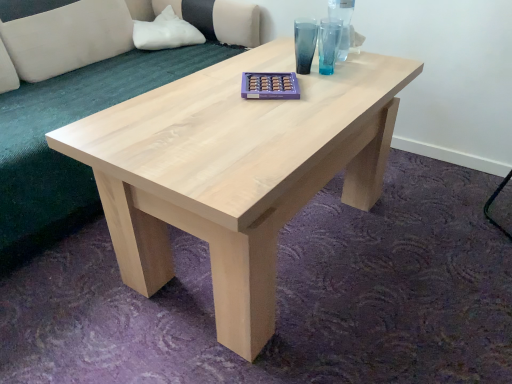
Identify the location of light beige fabric couch at upper left. This screenshot has width=512, height=384. (73, 121).

The image size is (512, 384). I want to click on transparent glass vase at upper center, so click(343, 23).

Is transparent glass vase at upper center next to white fabric pillow at upper left?

transparent glass vase at upper center is not next to white fabric pillow at upper left, and they're not touching.

What are the coordinates of `pillow behind the transparent glass vase at upper center` in the screenshot? It's located at (165, 32).

Is transparent glass vase at upper center aimed at white fabric pillow at upper left?

No, transparent glass vase at upper center is not oriented towards white fabric pillow at upper left.

Is white fabric pillow at upper left a part of transparent glass vase at upper center?

No, white fabric pillow at upper left is not surrounded by transparent glass vase at upper center.

Is natural wood coffee table at center wider than transparent glass vase at upper center?

Indeed, natural wood coffee table at center has a greater width compared to transparent glass vase at upper center.

Which is more to the right, natural wood coffee table at center or transparent glass vase at upper center?

From the viewer's perspective, transparent glass vase at upper center appears more on the right side.

Does natural wood coffee table at center have a larger size compared to transparent glass vase at upper center?

Indeed, natural wood coffee table at center has a larger size compared to transparent glass vase at upper center.

Is natural wood coffee table at center taller than transparent glass vase at upper center?

No, natural wood coffee table at center is not taller than transparent glass vase at upper center.

From a real-world perspective, which object rests below the other?

From a 3D spatial view, natural wood coffee table at center is below.

Is white fabric pillow at upper left positioned far away from natural wood coffee table at center?

Yes.

Consider the image. Is white fabric pillow at upper left in front of or behind natural wood coffee table at center in the image?

Clearly, white fabric pillow at upper left is behind natural wood coffee table at center.

At what (x,y) coordinates should I click in order to perform the action: click on glass vase that appears above the light beige fabric couch at upper left (from the image's perspective). Please return your answer as a coordinate pair (x, y). The image size is (512, 384). Looking at the image, I should click on (343, 23).

Considering their positions, is transparent glass vase at upper center located in front of or behind light beige fabric couch at upper left?

transparent glass vase at upper center is positioned farther from the viewer than light beige fabric couch at upper left.

In the scene shown: Which is closer, (345, 23) or (72, 221)?

Point (345, 23).

Could you measure the distance between transparent glass vase at upper center and light beige fabric couch at upper left?

They are 37.77 inches apart.

Considering the relative sizes of light beige fabric couch at upper left and natural wood coffee table at center in the image provided, is light beige fabric couch at upper left taller than natural wood coffee table at center?

Indeed, light beige fabric couch at upper left has a greater height compared to natural wood coffee table at center.

Which is in front, light beige fabric couch at upper left or natural wood coffee table at center?

natural wood coffee table at center.

Based on their positions, is light beige fabric couch at upper left located to the left or right of natural wood coffee table at center?

Based on their positions, light beige fabric couch at upper left is located to the left of natural wood coffee table at center.

From the image's perspective, who appears lower, light beige fabric couch at upper left or natural wood coffee table at center?

natural wood coffee table at center appears lower in the image.

From the image's perspective, which one is positioned lower, white fabric pillow at upper left or light beige fabric couch at upper left?

light beige fabric couch at upper left appears lower in the image.

From a real-world perspective, is white fabric pillow at upper left under light beige fabric couch at upper left?

Incorrect, from a real-world perspective, white fabric pillow at upper left is higher than light beige fabric couch at upper left.

Considering the relative positions of white fabric pillow at upper left and light beige fabric couch at upper left in the image provided, is white fabric pillow at upper left behind light beige fabric couch at upper left?

Yes, the depth of white fabric pillow at upper left is greater than that of light beige fabric couch at upper left.

Is white fabric pillow at upper left not inside light beige fabric couch at upper left?

Actually, white fabric pillow at upper left is within light beige fabric couch at upper left.

Which object is closer to the camera, transparent glass vase at upper center or natural wood coffee table at center?

natural wood coffee table at center is in front.

Considering the relative positions of transparent glass vase at upper center and natural wood coffee table at center in the image provided, is transparent glass vase at upper center to the left or to the right of natural wood coffee table at center?

Result: From the image, it's evident that transparent glass vase at upper center is to the right of natural wood coffee table at center.

Can you confirm if transparent glass vase at upper center is shorter than natural wood coffee table at center?

Incorrect, the height of transparent glass vase at upper center does not fall short of that of natural wood coffee table at center.

Is transparent glass vase at upper center not inside natural wood coffee table at center?

Yes, transparent glass vase at upper center is not within natural wood coffee table at center.

Where is `glass vase below the white fabric pillow at upper left (from the image's perspective)`? glass vase below the white fabric pillow at upper left (from the image's perspective) is located at coordinates (343, 23).

At what (x,y) coordinates should I click in order to perform the action: click on glass vase lying behind the natural wood coffee table at center. Please return your answer as a coordinate pair (x, y). Looking at the image, I should click on (343, 23).

From the image, which object appears to be nearer to transparent glass vase at upper center, natural wood coffee table at center or light beige fabric couch at upper left?

Based on the image, natural wood coffee table at center appears to be nearer to transparent glass vase at upper center.

Looking at the image, which one is located further to white fabric pillow at upper left, natural wood coffee table at center or transparent glass vase at upper center?

natural wood coffee table at center.

Which object lies further to the anchor point transparent glass vase at upper center, white fabric pillow at upper left or light beige fabric couch at upper left?

Based on the image, white fabric pillow at upper left appears to be further to transparent glass vase at upper center.

From the image, which object appears to be farther from natural wood coffee table at center, transparent glass vase at upper center or white fabric pillow at upper left?

white fabric pillow at upper left lies further to natural wood coffee table at center than the other object.

Based on their spatial positions, is transparent glass vase at upper center or light beige fabric couch at upper left closer to white fabric pillow at upper left?

light beige fabric couch at upper left.

From the image, which object appears to be nearer to natural wood coffee table at center, light beige fabric couch at upper left or transparent glass vase at upper center?

transparent glass vase at upper center is closer to natural wood coffee table at center.

Based on their spatial positions, is white fabric pillow at upper left or natural wood coffee table at center closer to light beige fabric couch at upper left?

Based on the image, white fabric pillow at upper left appears to be nearer to light beige fabric couch at upper left.

From the image, which object appears to be nearer to natural wood coffee table at center, white fabric pillow at upper left or transparent glass vase at upper center?

transparent glass vase at upper center lies closer to natural wood coffee table at center than the other object.

Identify the location of glass vase located between natural wood coffee table at center and white fabric pillow at upper left in the depth direction. Image resolution: width=512 pixels, height=384 pixels. (343, 23).

At what (x,y) coordinates should I click in order to perform the action: click on coffee table between light beige fabric couch at upper left and transparent glass vase at upper center in the horizontal direction. Please return your answer as a coordinate pair (x, y). This screenshot has width=512, height=384. Looking at the image, I should click on (234, 170).

Where is `couch between natural wood coffee table at center and white fabric pillow at upper left in the front-back direction`? The image size is (512, 384). couch between natural wood coffee table at center and white fabric pillow at upper left in the front-back direction is located at coordinates (73, 121).

Where is `pillow between light beige fabric couch at upper left and transparent glass vase at upper center`? Image resolution: width=512 pixels, height=384 pixels. pillow between light beige fabric couch at upper left and transparent glass vase at upper center is located at coordinates (165, 32).